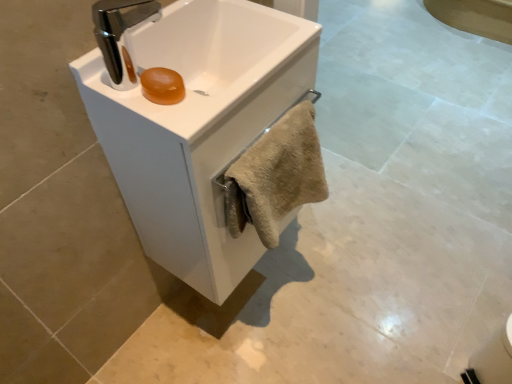
Identify the location of white glossy sink at center, the first sink viewed from the front. The image size is (512, 384). (202, 59).

The image size is (512, 384). What do you see at coordinates (202, 59) in the screenshot?
I see `white glossy sink at center, the 2th sink positioned from the back` at bounding box center [202, 59].

In order to face white glossy sink at center, arranged as the second sink when viewed from the front, should I rotate leftwards or rightwards?

Turn left approximately 4.269 degrees to face it.

This screenshot has height=384, width=512. What are the coordinates of `white glossy sink at center, the first sink viewed from the front` in the screenshot? It's located at pos(202,59).

From the image's perspective, does white glossy sink at center, the 2th sink positioned from the back, appear lower than beige fuzzy towel at center?

No, from the image's perspective, white glossy sink at center, the 2th sink positioned from the back, is not beneath beige fuzzy towel at center.

Does point (294, 33) come behind point (282, 167)?

Yes, it is behind point (282, 167).

Considering the relative positions of white glossy sink at center, the first sink viewed from the front, and beige fuzzy towel at center in the image provided, is white glossy sink at center, the first sink viewed from the front, to the left or to the right of beige fuzzy towel at center?

From the image, it's evident that white glossy sink at center, the first sink viewed from the front, is to the left of beige fuzzy towel at center.

Does white glossy sink at center, the 2th sink positioned from the back, have a greater width compared to beige fuzzy towel at center?

Yes.

Between point (207, 201) and point (315, 201), which one is positioned in front?

Point (207, 201)

Is white glossy sink at center, arranged as the second sink when viewed from the front, completely or partially outside of beige fuzzy towel at center?

Indeed, white glossy sink at center, arranged as the second sink when viewed from the front, is completely outside beige fuzzy towel at center.

Is white glossy sink at center, arranged as the second sink when viewed from the front, taller than beige fuzzy towel at center?

Indeed, white glossy sink at center, arranged as the second sink when viewed from the front, has a greater height compared to beige fuzzy towel at center.

Which object is thinner, white glossy sink at center, arranged as the second sink when viewed from the front, or beige fuzzy towel at center?

Thinner between the two is beige fuzzy towel at center.

Is beige fuzzy towel at center oriented away from white glossy sink at center, the 2th sink positioned from the back?

That's right, beige fuzzy towel at center is facing away from white glossy sink at center, the 2th sink positioned from the back.

Would you say beige fuzzy towel at center is a long distance from white glossy sink at center, the first sink viewed from the front?

They are positioned close to each other.

From a real-world perspective, which is physically above, beige fuzzy towel at center or white glossy sink at center, the first sink viewed from the front?

In real-world perspective, white glossy sink at center, the first sink viewed from the front, is above.

In the scene shown: Considering the sizes of objects beige fuzzy towel at center and white glossy sink at center, the 2th sink positioned from the back, in the image provided, who is thinner, beige fuzzy towel at center or white glossy sink at center, the 2th sink positioned from the back,?

beige fuzzy towel at center.

Is beige fuzzy towel at center to the left or to the right of white glossy sink at center, arranged as the second sink when viewed from the front, in the image?

In the image, beige fuzzy towel at center appears on the right side of white glossy sink at center, arranged as the second sink when viewed from the front.

Is beige fuzzy towel at center not near white glossy sink at center, marked as the 1th sink in a back-to-front arrangement?

They are positioned close to each other.

Between beige fuzzy towel at center and white glossy sink at center, arranged as the second sink when viewed from the front, which one has smaller size?

Smaller between the two is beige fuzzy towel at center.

Considering the relative positions of white glossy sink at center, marked as the 1th sink in a back-to-front arrangement, and white glossy sink at center, the 2th sink positioned from the back, in the image provided, is white glossy sink at center, marked as the 1th sink in a back-to-front arrangement, to the left or to the right of white glossy sink at center, the 2th sink positioned from the back,?

From the image, it's evident that white glossy sink at center, marked as the 1th sink in a back-to-front arrangement, is to the right of white glossy sink at center, the 2th sink positioned from the back.

From the image's perspective, which object appears higher, white glossy sink at center, arranged as the second sink when viewed from the front, or white glossy sink at center, the first sink viewed from the front?

white glossy sink at center, the first sink viewed from the front, from the image's perspective.

Is the surface of white glossy sink at center, marked as the 1th sink in a back-to-front arrangement, in direct contact with white glossy sink at center, the 2th sink positioned from the back?

Yes, white glossy sink at center, marked as the 1th sink in a back-to-front arrangement, is touching white glossy sink at center, the 2th sink positioned from the back.

Looking at this image, is white glossy sink at center, marked as the 1th sink in a back-to-front arrangement, oriented towards white glossy sink at center, the 2th sink positioned from the back?

No, white glossy sink at center, marked as the 1th sink in a back-to-front arrangement, is not facing towards white glossy sink at center, the 2th sink positioned from the back.

Which object is further away from the camera, white glossy sink at center, the first sink viewed from the front, or white glossy sink at center, marked as the 1th sink in a back-to-front arrangement?

white glossy sink at center, marked as the 1th sink in a back-to-front arrangement, is further from the camera.

From their relative heights in the image, would you say white glossy sink at center, the first sink viewed from the front, is taller or shorter than white glossy sink at center, marked as the 1th sink in a back-to-front arrangement?

In the image, white glossy sink at center, the first sink viewed from the front, appears to be shorter than white glossy sink at center, marked as the 1th sink in a back-to-front arrangement.

Which of these two, white glossy sink at center, the first sink viewed from the front, or white glossy sink at center, marked as the 1th sink in a back-to-front arrangement, is bigger?

white glossy sink at center, marked as the 1th sink in a back-to-front arrangement.

I want to click on sink that is on the left side of white glossy sink at center, marked as the 1th sink in a back-to-front arrangement, so click(202, 59).

This screenshot has height=384, width=512. Identify the location of the 2nd sink in front of the beige fuzzy towel at center. (202, 59).

Where is `sink below the beige fuzzy towel at center (from a real-world perspective)`? This screenshot has height=384, width=512. sink below the beige fuzzy towel at center (from a real-world perspective) is located at coordinates (197, 126).

Based on their spatial positions, is beige fuzzy towel at center or white glossy sink at center, the first sink viewed from the front, further from white glossy sink at center, arranged as the second sink when viewed from the front?

beige fuzzy towel at center.

From the image, which object appears to be farther from white glossy sink at center, the 2th sink positioned from the back, white glossy sink at center, arranged as the second sink when viewed from the front, or beige fuzzy towel at center?

Among the two, beige fuzzy towel at center is located further to white glossy sink at center, the 2th sink positioned from the back.

Estimate the real-world distances between objects in this image. Which object is closer to beige fuzzy towel at center, white glossy sink at center, the 2th sink positioned from the back, or white glossy sink at center, marked as the 1th sink in a back-to-front arrangement?

white glossy sink at center, marked as the 1th sink in a back-to-front arrangement, lies closer to beige fuzzy towel at center than the other object.

Which object lies further to the anchor point white glossy sink at center, marked as the 1th sink in a back-to-front arrangement, white glossy sink at center, the first sink viewed from the front, or beige fuzzy towel at center?

beige fuzzy towel at center.

Which object lies further to the anchor point white glossy sink at center, the first sink viewed from the front, beige fuzzy towel at center or white glossy sink at center, arranged as the second sink when viewed from the front?

beige fuzzy towel at center lies further to white glossy sink at center, the first sink viewed from the front, than the other object.

Which object lies further to the anchor point beige fuzzy towel at center, white glossy sink at center, arranged as the second sink when viewed from the front, or white glossy sink at center, the 2th sink positioned from the back?

The object further to beige fuzzy towel at center is white glossy sink at center, the 2th sink positioned from the back.

You are a GUI agent. You are given a task and a screenshot of the screen. Output one action in this format:
    pyautogui.click(x=<x>, y=<y>)
    Task: Click on the bath towel that lies between white glossy sink at center, the 2th sink positioned from the back, and white glossy sink at center, arranged as the second sink when viewed from the front, from top to bottom
    This screenshot has height=384, width=512.
    Given the screenshot: What is the action you would take?
    pyautogui.click(x=276, y=175)